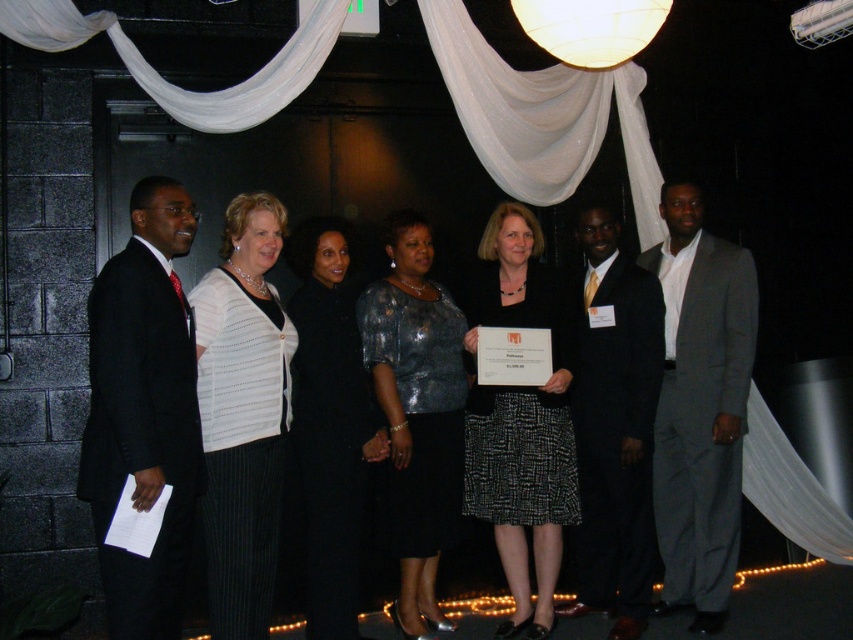
Is point (241, 632) positioned in front of point (566, 324)?

Yes.

Locate an element on the screen. This screenshot has width=853, height=640. white textured blouse at center is located at coordinates (242, 413).

Based on the photo, who is higher up, shiny black suit at center or black sequined dress at center?

Positioned higher is black sequined dress at center.

Consider the image. Between shiny black suit at center and black sequined dress at center, which one has more height?

shiny black suit at center

Between point (583, 452) and point (347, 561), which one is positioned in front?

Point (347, 561) is in front.

Find the location of `shiny black suit at center`. shiny black suit at center is located at coordinates (614, 429).

Which is behind, point (404, 515) or point (352, 570)?

Positioned behind is point (404, 515).

This screenshot has width=853, height=640. What are the coordinates of `sparkly silver blouse at center` in the screenshot? It's located at (416, 413).

Where is `sparkly silver blouse at center`? The height and width of the screenshot is (640, 853). sparkly silver blouse at center is located at coordinates (416, 413).